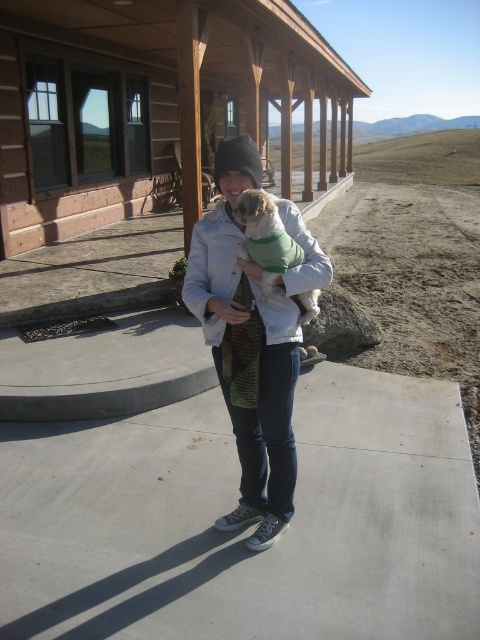
You are a fashion designer observing a person wearing a denim jacket at center and a fuzzy green sweater at center. Which clothing item is taller on the person?

The denim jacket at center is much taller than the fuzzy green sweater at center.

You are a photographer trying to capture a photo of the wooden log cabin at upper center and the fuzzy green sweater at center. Based on their sizes, which object should you focus on first to ensure both are in frame?

The wooden log cabin at upper center is taller than the fuzzy green sweater at center, so you should focus on the wooden log cabin at upper center first to ensure both are in frame.

You are taking a photo of the scene and want to focus on both the person and the small dog. The person is at point (251, 301) and the dog is at point (247, 212). Which point should you focus on first to ensure both are in focus?

You should focus on point (247, 212) first because it is closer to the camera than point (251, 301). By focusing on the closer point, the depth of field may include both points in focus.